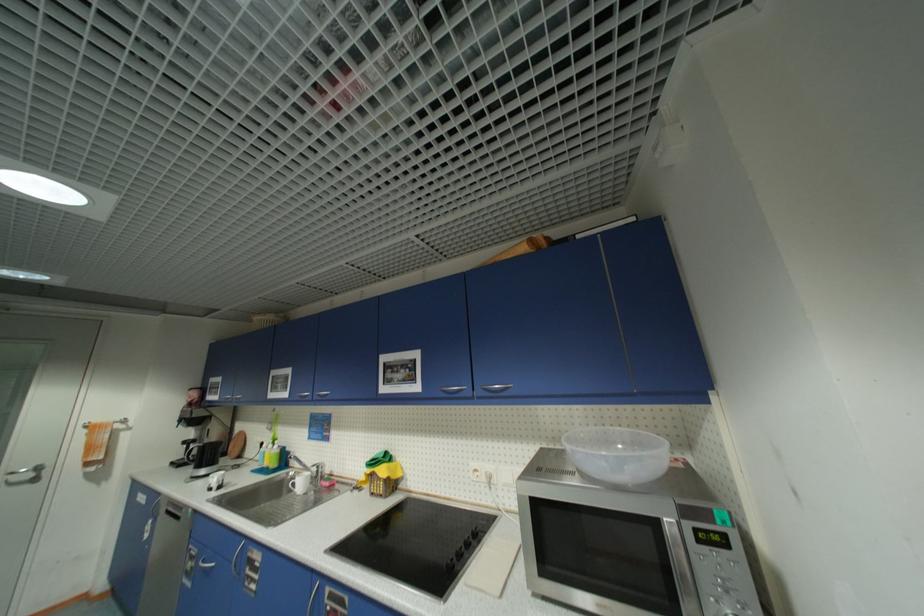
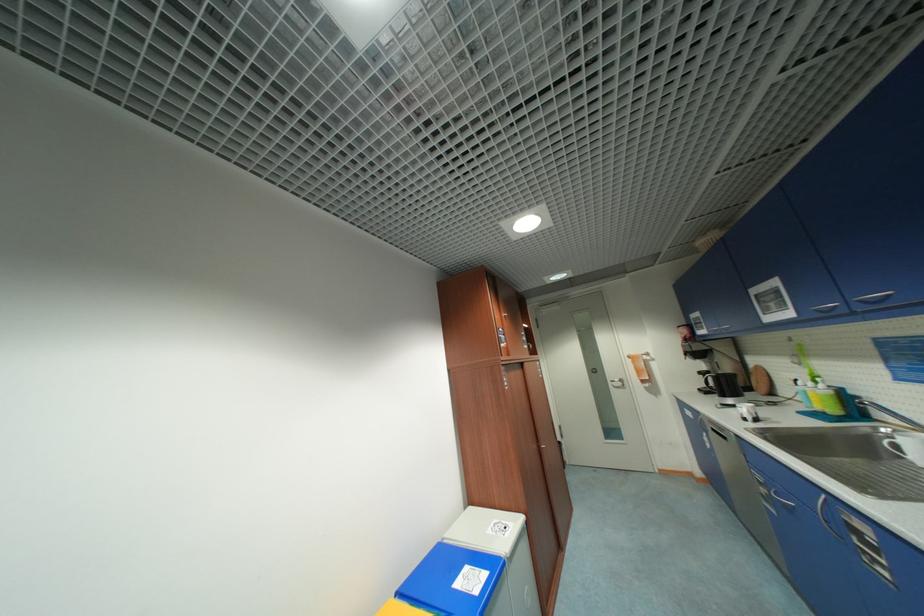
Locate, in the second image, the point that corresponds to (x=178, y=464) in the first image.

(706, 391)